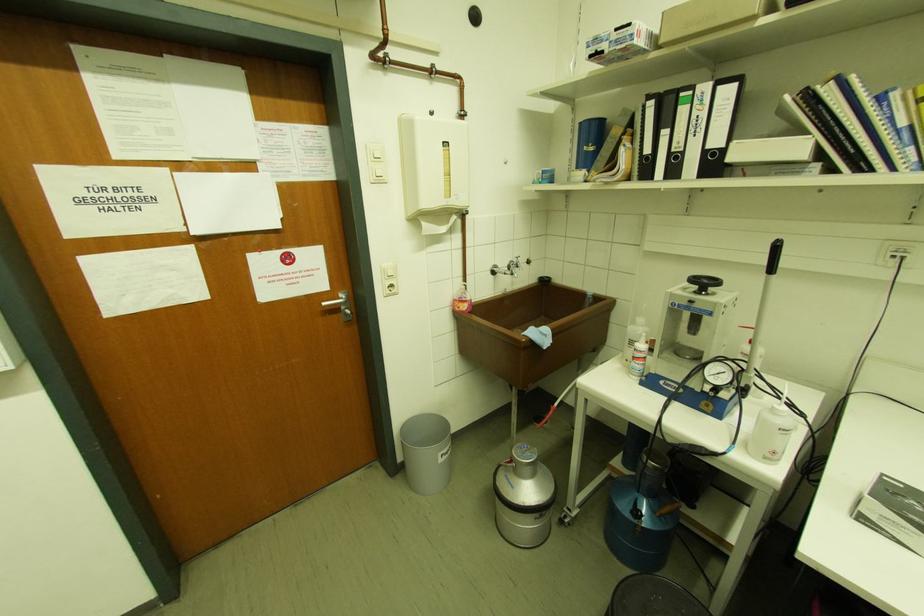
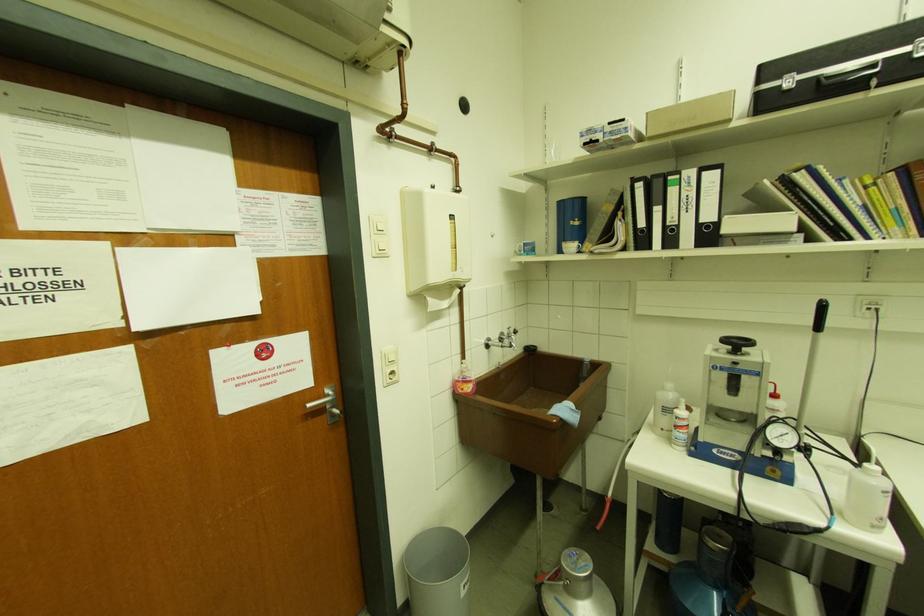
Question: The first image is from the beginning of the video and the second image is from the end. How did the camera likely rotate when shooting the video?

Choices:
 (A) Left
 (B) Right
 (C) Up
 (D) Down

Answer: (B)